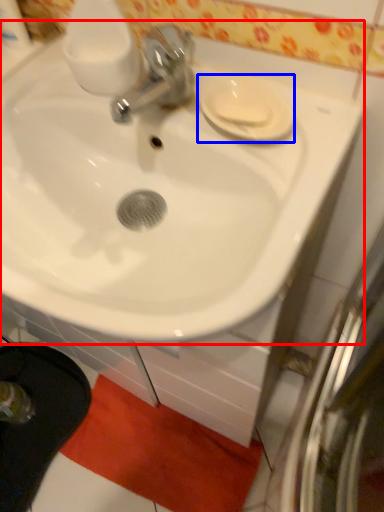
Question: Which of the following is the farthest to the observer, sink (highlighted by a red box) or saucer (highlighted by a blue box)?

Choices:
 (A) sink
 (B) saucer

Answer: (B)